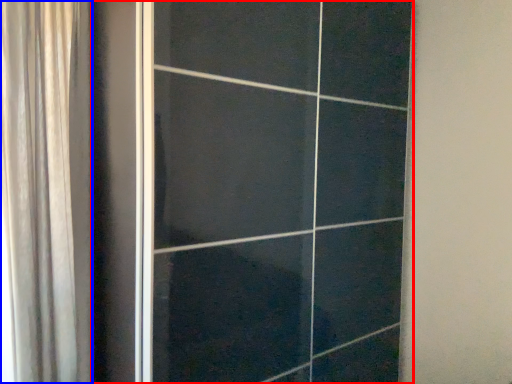
Question: Which of the following is the closest to the observer, door (highlighted by a red box) or curtain (highlighted by a blue box)?

Choices:
 (A) door
 (B) curtain

Answer: (A)